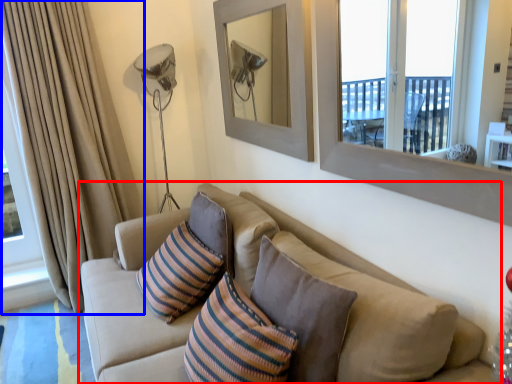
Question: Which object is closer to the camera taking this photo, studio couch (highlighted by a red box) or curtain (highlighted by a blue box)?

Choices:
 (A) studio couch
 (B) curtain

Answer: (A)